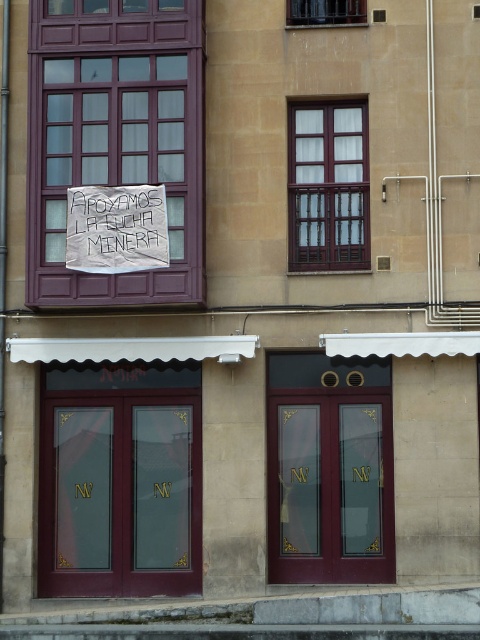
In the scene shown: You are a delivery person trying to see the banner text on the wooden window at center. The burgundy glass doors at center are blocking your view. Can you walk around the doors to see the banner text?

The burgundy glass doors at center are taller than the wooden window at center, so if you walk around the doors, you might still be able to see the banner text on the wooden window at center since the window is shorter and not completely blocked by the doors.

You are a delivery person trying to enter the building through the doors. The doors are surrounded by burgundy glass doors at center and a white paper sign at upper center. Which object is wider so you can estimate the door width?

The burgundy glass doors at center are wider than the white paper sign at upper center, so the doors are wider than the sign.

You are standing in front of the building and want to locate the matte burgundy door at center. According to the coordinates provided, where should you look relative to the image frame?

The matte burgundy door at center is located at coordinates point 0.772 on the x axis and 0.250 on the y axis relative to the image frame.